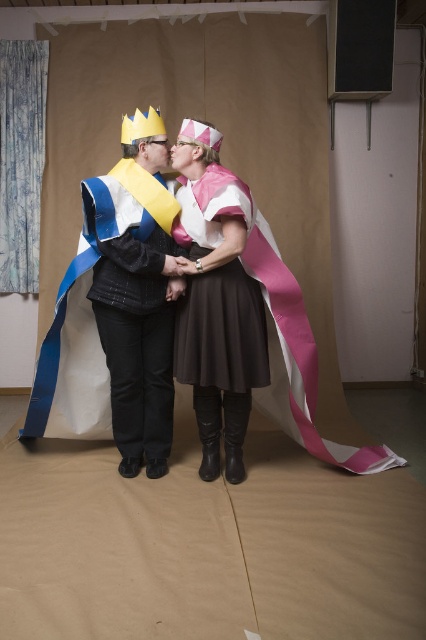
In the scene shown: Does pink satin cape at center appear on the right side of matte black jacket at center?

Yes, pink satin cape at center is to the right of matte black jacket at center.

Locate an element on the screen. The image size is (426, 640). pink satin cape at center is located at coordinates (216, 316).

The height and width of the screenshot is (640, 426). I want to click on pink satin cape at center, so click(216, 316).